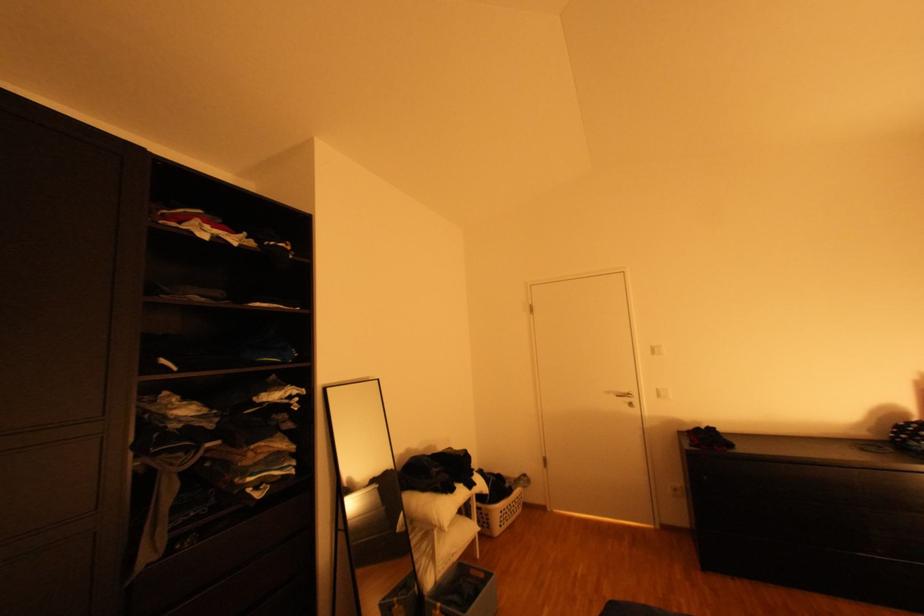
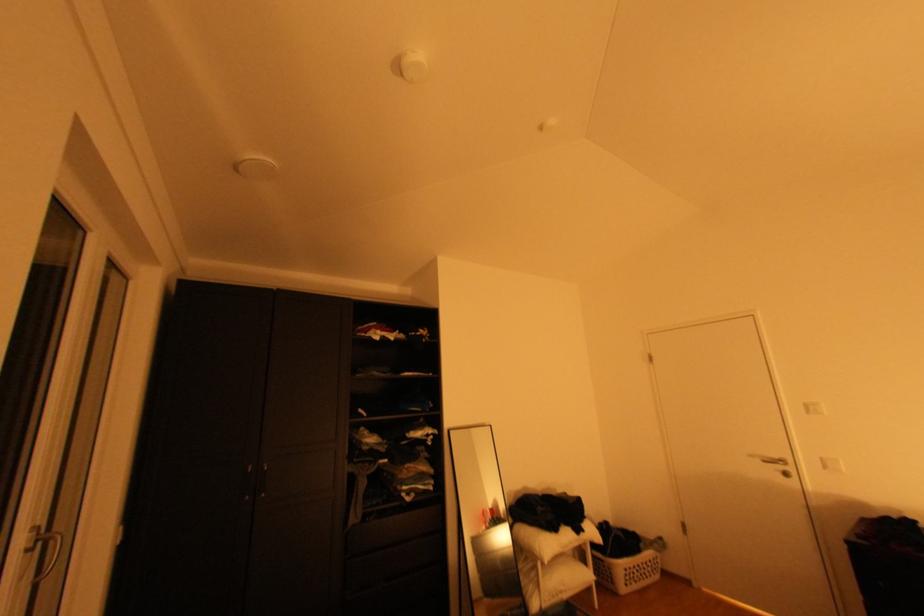
Find the pixel in the second image that matches [636,391] in the first image.

(786, 456)